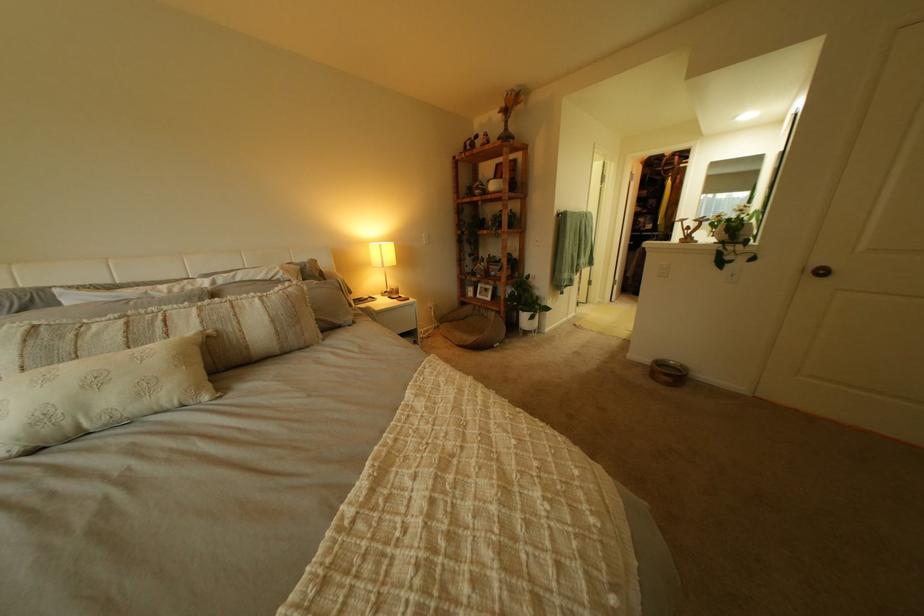
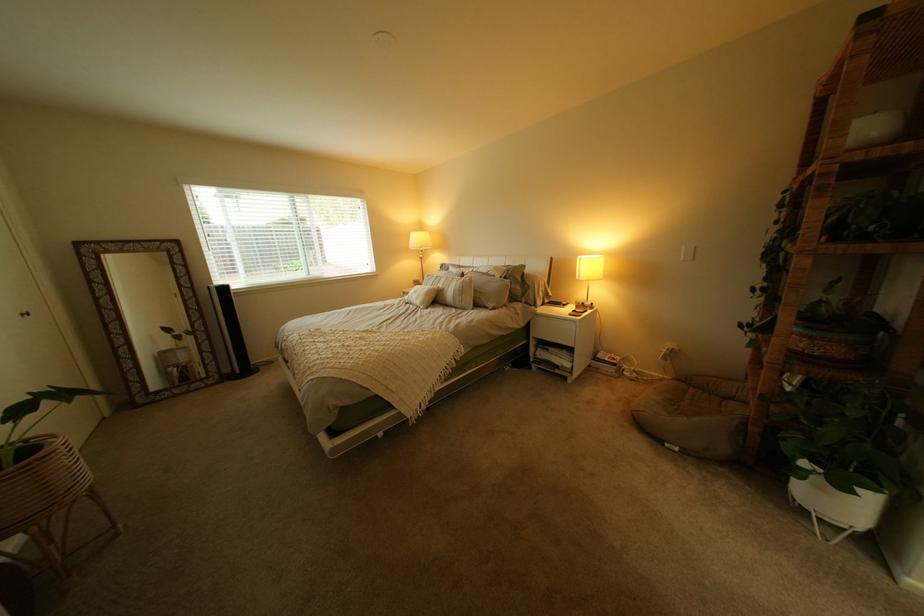
The point at (370, 323) is marked in the first image. Where is the corresponding point in the second image?

(509, 310)